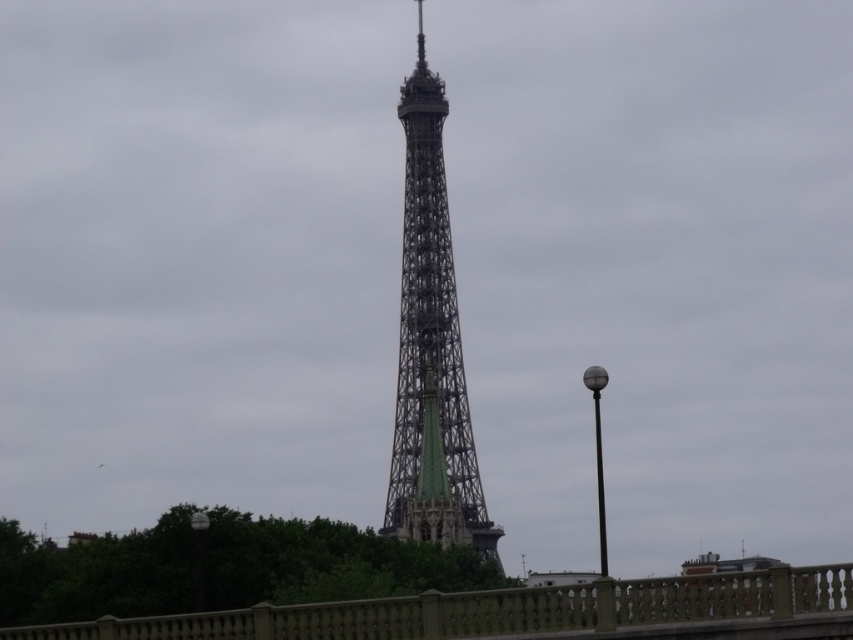
Consider the image. You are a tourist standing at the beige stone fence at lower center, and you want to take a photo of the metallic lattice tower at center. If your camera can focus up to 70 meters, will you be able to capture the tower clearly?

The beige stone fence at lower center is 67.01 meters from the metallic lattice tower at center. Since 67.01 meters is within the camera focus range of 70 meters, the camera can focus on the tower clearly.

You are standing at the base of the Eiffel Tower and want to take a photo of the beige stone fence at lower center. According to the coordinates provided, where should you position yourself to capture the fence in the center of your camera view?

The beige stone fence at lower center is located at coordinates point (519, 611), so you should position yourself to aim your camera towards that point to center the fence in your view.